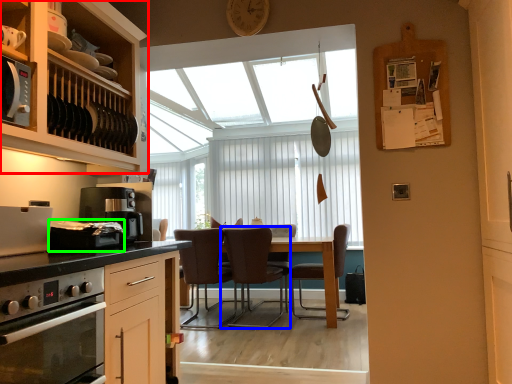
Question: Considering the real-world distances, which object is farthest from cabinetry (highlighted by a red box)? chair (highlighted by a blue box) or appliance (highlighted by a green box)?

Choices:
 (A) chair
 (B) appliance

Answer: (A)